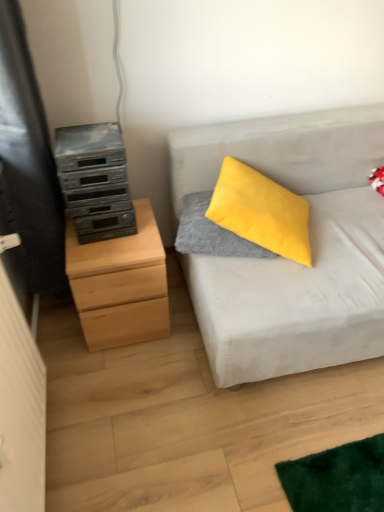
Question: Are light gray fabric couch at right and natural wood chest of drawers at left making contact?

Choices:
 (A) no
 (B) yes

Answer: (A)

Question: Considering the relative sizes of light gray fabric couch at right and natural wood chest of drawers at left in the image provided, is light gray fabric couch at right shorter than natural wood chest of drawers at left?

Choices:
 (A) no
 (B) yes

Answer: (A)

Question: Is light gray fabric couch at right at the right side of natural wood chest of drawers at left?

Choices:
 (A) yes
 (B) no

Answer: (A)

Question: Is light gray fabric couch at right at the left side of natural wood chest of drawers at left?

Choices:
 (A) yes
 (B) no

Answer: (B)

Question: Is light gray fabric couch at right not near natural wood chest of drawers at left?

Choices:
 (A) no
 (B) yes

Answer: (A)

Question: From a real-world perspective, is velvety gray pillow at center above or below light gray fabric couch at right?

Choices:
 (A) above
 (B) below

Answer: (A)

Question: Is velvety gray pillow at center to the left or to the right of light gray fabric couch at right in the image?

Choices:
 (A) left
 (B) right

Answer: (A)

Question: Looking at their shapes, would you say velvety gray pillow at center is wider or thinner than light gray fabric couch at right?

Choices:
 (A) thin
 (B) wide

Answer: (A)

Question: Is velvety gray pillow at center spatially inside light gray fabric couch at right, or outside of it?

Choices:
 (A) outside
 (B) inside

Answer: (B)

Question: Would you say silver metallic stereo at left is inside or outside velvety gray pillow at center?

Choices:
 (A) inside
 (B) outside

Answer: (B)

Question: Is silver metallic stereo at left wider or thinner than velvety gray pillow at center?

Choices:
 (A) thin
 (B) wide

Answer: (A)

Question: From a real-world perspective, is silver metallic stereo at left positioned above or below velvety gray pillow at center?

Choices:
 (A) above
 (B) below

Answer: (A)

Question: From the image's perspective, relative to velvety gray pillow at center, is silver metallic stereo at left above or below?

Choices:
 (A) above
 (B) below

Answer: (A)

Question: From the image's perspective, relative to silver metallic stereo at left, is light gray fabric couch at right above or below?

Choices:
 (A) above
 (B) below

Answer: (B)

Question: Looking at their shapes, would you say light gray fabric couch at right is wider or thinner than silver metallic stereo at left?

Choices:
 (A) wide
 (B) thin

Answer: (A)